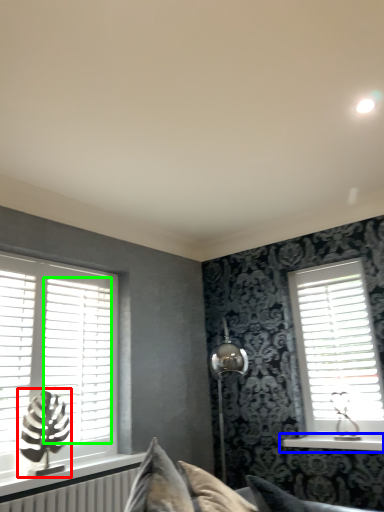
Question: Which object is the farthest from table lamp (highlighted by a red box)? Choose among these: window sill (highlighted by a blue box) or blind (highlighted by a green box).

Choices:
 (A) window sill
 (B) blind

Answer: (A)